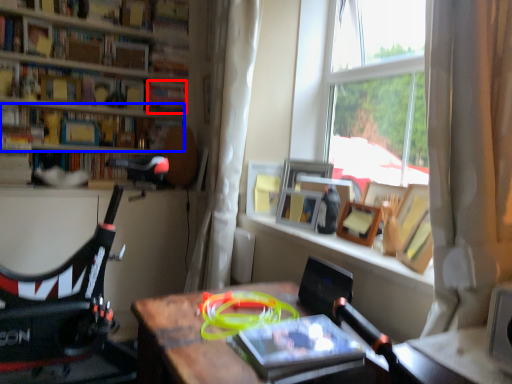
Question: Which point is further to the camera, book (highlighted by a red box) or book (highlighted by a blue box)?

Choices:
 (A) book
 (B) book

Answer: (A)